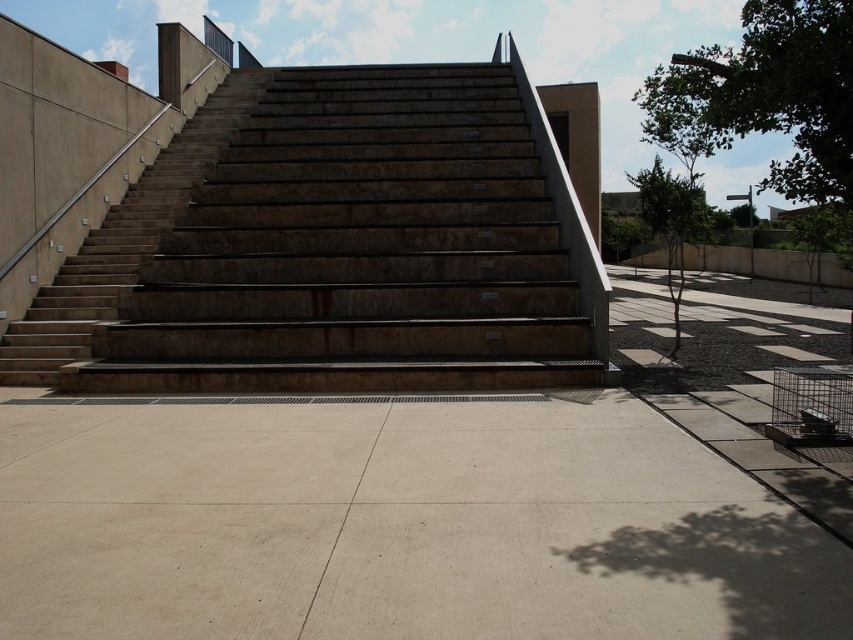
You are standing on the beige concrete pavement at center and want to climb up to the brown stone stairs at center. Is the path directly ahead of you clear for climbing?

Yes, the path directly ahead is clear because the beige concrete pavement at center is below the brown stone stairs at center, indicating a direct upward path.

You are standing at the bottom of the stairs and want to reach the platform at the top. You notice two points marked on the image, point (634, 433) and point (166, 198). Which point is closer to you as you stand at the bottom?

Point (634, 433) is closer to the viewer than point (166, 198). Therefore, the point closer to you as you stand at the bottom is point (634, 433).